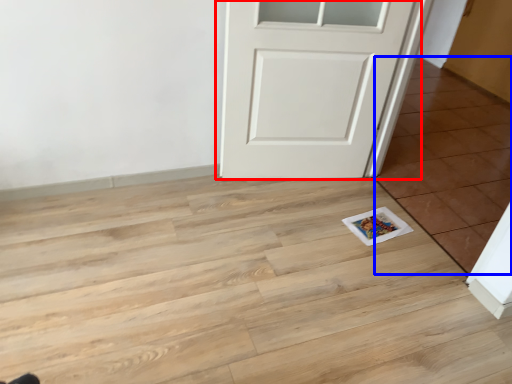
Question: Which point is closer to the camera, door (highlighted by a red box) or tile (highlighted by a blue box)?

Choices:
 (A) door
 (B) tile

Answer: (B)